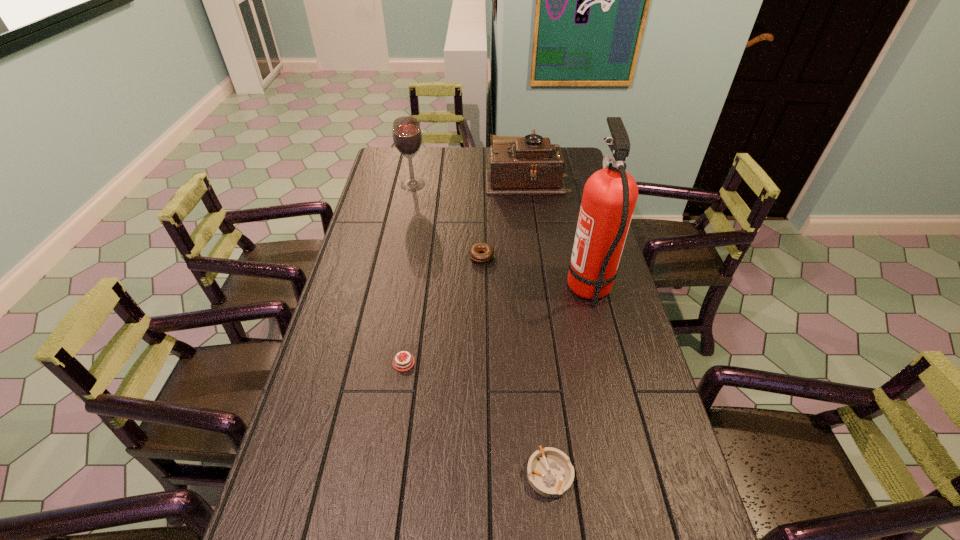
You are a GUI agent. You are given a task and a screenshot of the screen. Output one action in this format:
    pyautogui.click(x=<x>, y=<y>)
    Task: Click on the tallest object
    This screenshot has height=540, width=960.
    Given the screenshot: What is the action you would take?
    pyautogui.click(x=610, y=194)

Locate an element on the screen. The height and width of the screenshot is (540, 960). alcohol is located at coordinates (407, 136).

Identify the location of phonograph_record. (531, 165).

Find the location of a particular element. Image resolution: width=960 pixels, height=540 pixels. doughnut is located at coordinates (478, 247).

In order to click on the second nearest object in this screenshot , I will do `click(402, 363)`.

I want to click on ashtray, so click(550, 473).

You are a GUI agent. You are given a task and a screenshot of the screen. Output one action in this format:
    pyautogui.click(x=<x>, y=<y>)
    Task: Click on the vacant space located 0.140m on the handle side of the fire extinguisher
    This screenshot has height=540, width=960.
    Given the screenshot: What is the action you would take?
    pyautogui.click(x=523, y=290)

This screenshot has height=540, width=960. Find the location of `vacant space located 0.370m on the handle side of the fire extinguisher`. vacant space located 0.370m on the handle side of the fire extinguisher is located at coordinates (452, 290).

Image resolution: width=960 pixels, height=540 pixels. In order to click on vacant space situated on the handle side of the fire extinguisher in this screenshot , I will do `click(541, 290)`.

Identify the location of vacant area situated 0.270m on the right of the second tallest object. Image resolution: width=960 pixels, height=540 pixels. (490, 185).